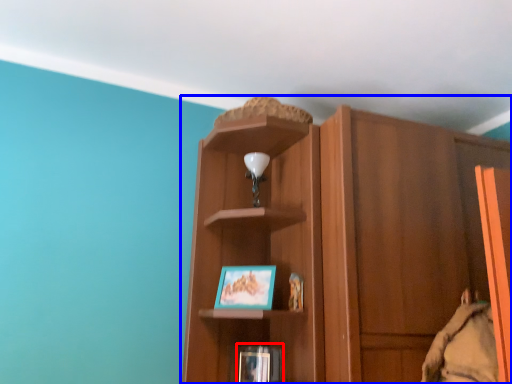
Question: Which of the following is the closest to the observer, book (highlighted by a red box) or cupboard (highlighted by a blue box)?

Choices:
 (A) book
 (B) cupboard

Answer: (B)